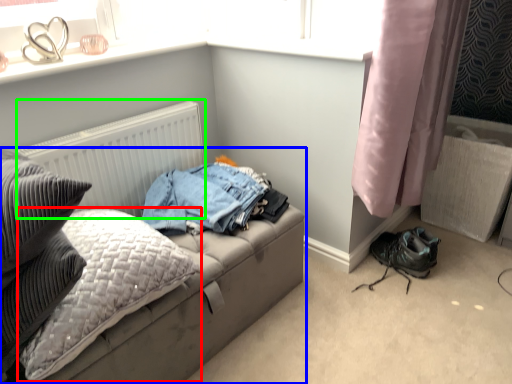
Question: Estimate the real-world distances between objects in this image. Which object is farther from pillow (highlighted by a red box), studio couch (highlighted by a blue box) or radiator (highlighted by a green box)?

Choices:
 (A) studio couch
 (B) radiator

Answer: (B)